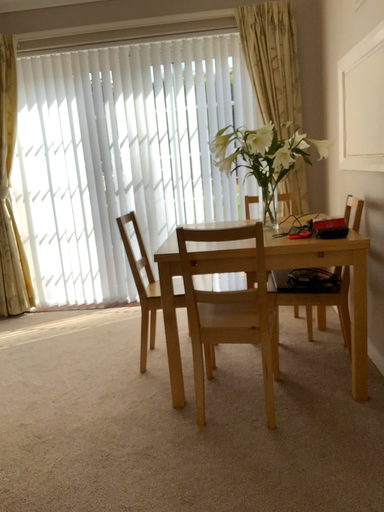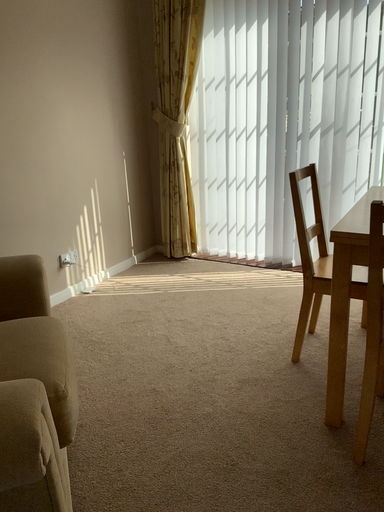
Question: Which way did the camera rotate in the video?

Choices:
 (A) rotated right
 (B) rotated left

Answer: (B)